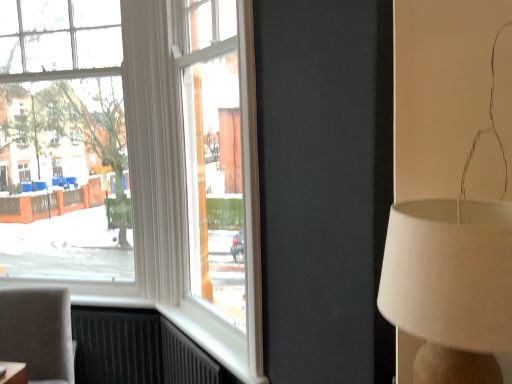
I want to click on clear glass window at left, so click(x=63, y=141).

The width and height of the screenshot is (512, 384). What do you see at coordinates (38, 333) in the screenshot?
I see `matte gray chair at lower left` at bounding box center [38, 333].

The width and height of the screenshot is (512, 384). Find the location of `clear glass window at left`. clear glass window at left is located at coordinates (63, 141).

From the image's perspective, would you say clear glass window at left is shown under matte gray chair at lower left?

No, from the image's perspective, clear glass window at left is not below matte gray chair at lower left.

Considering the relative sizes of clear glass window at left and matte gray chair at lower left in the image provided, is clear glass window at left shorter than matte gray chair at lower left?

No.

Is clear glass window at left spatially inside matte gray chair at lower left, or outside of it?

clear glass window at left is outside matte gray chair at lower left.

At what (x,y) coordinates should I click in order to perform the action: click on furniture below the clear glass window at left (from a real-world perspective). Please return your answer as a coordinate pair (x, y). The width and height of the screenshot is (512, 384). Looking at the image, I should click on (38, 333).

Does white fabric lampshade at right come behind clear glass window at left?

No, white fabric lampshade at right is in front of clear glass window at left.

From the picture: From a real-world perspective, is white fabric lampshade at right physically located above or below clear glass window at left?

white fabric lampshade at right is below clear glass window at left.

Considering the positions of objects white fabric lampshade at right and clear glass window at left in the image provided, who is more to the right, white fabric lampshade at right or clear glass window at left?

white fabric lampshade at right is more to the right.

Is white fabric lampshade at right not near matte gray chair at lower left?

white fabric lampshade at right is positioned a significant distance from matte gray chair at lower left.

Is point (472, 264) positioned after point (37, 349)?

No.

Based on the photo, from a real-world perspective, is white fabric lampshade at right positioned under matte gray chair at lower left based on gravity?

No, from a real-world perspective, white fabric lampshade at right is not under matte gray chair at lower left.

Is white fabric lampshade at right facing towards matte gray chair at lower left?

No, white fabric lampshade at right does not turn towards matte gray chair at lower left.

Is matte gray chair at lower left smaller than white fabric lampshade at right?

Incorrect, matte gray chair at lower left is not smaller in size than white fabric lampshade at right.

Considering the positions of objects matte gray chair at lower left and white fabric lampshade at right in the image provided, who is more to the right, matte gray chair at lower left or white fabric lampshade at right?

Positioned to the right is white fabric lampshade at right.

Which is farther, (60,335) or (460,212)?

The point (60,335) is more distant.

Considering the relative sizes of matte gray chair at lower left and white fabric lampshade at right in the image provided, is matte gray chair at lower left thinner than white fabric lampshade at right?

In fact, matte gray chair at lower left might be wider than white fabric lampshade at right.

Is clear glass window at left facing towards white fabric lampshade at right?

No, clear glass window at left does not turn towards white fabric lampshade at right.

Between clear glass window at left and white fabric lampshade at right, which one is positioned behind?

clear glass window at left is more distant.

From a real-world perspective, is clear glass window at left over white fabric lampshade at right?

Indeed, from a real-world perspective, clear glass window at left stands above white fabric lampshade at right.

What's the angular difference between clear glass window at left and white fabric lampshade at right's facing directions?

The angle between the facing direction of clear glass window at left and the facing direction of white fabric lampshade at right is 0.553 degrees.

From a real-world perspective, is matte gray chair at lower left positioned over clear glass window at left based on gravity?

No.

Identify the location of furniture to the right of clear glass window at left. The image size is (512, 384). (38, 333).

Is matte gray chair at lower left closer to the viewer compared to clear glass window at left?

Yes, matte gray chair at lower left is closer to the viewer.

The image size is (512, 384). In order to click on window positioned vertically above the matte gray chair at lower left (from a real-world perspective) in this screenshot , I will do `click(63, 141)`.

Find the location of a particular element. lamp below the clear glass window at left (from the image's perspective) is located at coordinates (450, 286).

Based on the photo, when comparing their distances from white fabric lampshade at right, does clear glass window at left or matte gray chair at lower left seem closer?

matte gray chair at lower left.

Estimate the real-world distances between objects in this image. Which object is further from white fabric lampshade at right, matte gray chair at lower left or clear glass window at left?

clear glass window at left.

Based on the photo, estimate the real-world distances between objects in this image. Which object is closer to clear glass window at left, white fabric lampshade at right or matte gray chair at lower left?

matte gray chair at lower left is closer to clear glass window at left.

Estimate the real-world distances between objects in this image. Which object is closer to matte gray chair at lower left, clear glass window at left or white fabric lampshade at right?

clear glass window at left is closer to matte gray chair at lower left.

Which object lies further to the anchor point matte gray chair at lower left, white fabric lampshade at right or clear glass window at left?

The object further to matte gray chair at lower left is white fabric lampshade at right.

Estimate the real-world distances between objects in this image. Which object is closer to clear glass window at left, matte gray chair at lower left or white fabric lampshade at right?

matte gray chair at lower left is closer to clear glass window at left.

Locate an element on the screen. furniture between clear glass window at left and white fabric lampshade at right is located at coordinates (38, 333).